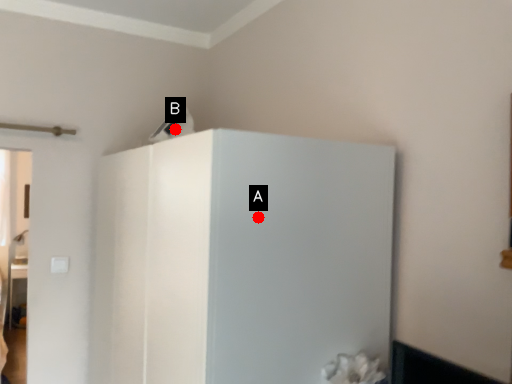
Question: Two points are circled on the image, labeled by A and B beside each circle. Which point appears closest to the camera in this image?

Choices:
 (A) A is closer
 (B) B is closer

Answer: (A)